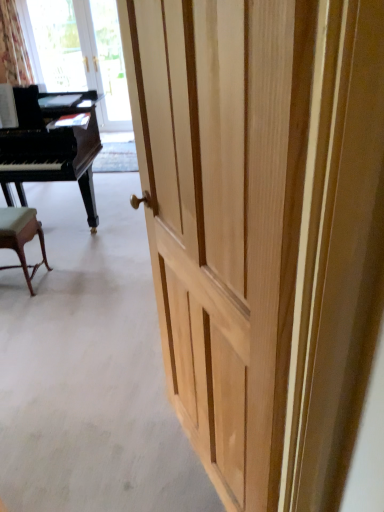
This screenshot has width=384, height=512. I want to click on transparent glass door at upper left, so click(x=110, y=67).

What do you see at coordinates (263, 230) in the screenshot? The width and height of the screenshot is (384, 512). I see `natural wood door at center` at bounding box center [263, 230].

What are the coordinates of `floral fabric curtain at upper left` in the screenshot? It's located at (13, 48).

Is natural wood door at center aimed at black polished piano at left?

No, natural wood door at center is not aimed at black polished piano at left.

Which is in front, natural wood door at center or black polished piano at left?

natural wood door at center is closer to the camera.

From the picture: Can you confirm if natural wood door at center is thinner than black polished piano at left?

Yes.

Can you confirm if natural wood door at center is taller than black polished piano at left?

Yes.

Does transparent glass window screen at upper left turn towards floral fabric curtain at upper left?

No.

Does point (65, 27) come closer to viewer compared to point (1, 42)?

No, (65, 27) is further to viewer.

This screenshot has width=384, height=512. I want to click on curtain below the transparent glass window screen at upper left (from the image's perspective), so click(x=13, y=48).

Is transparent glass window screen at upper left not close to floral fabric curtain at upper left?

Actually, transparent glass window screen at upper left and floral fabric curtain at upper left are a little close together.

Which is more to the right, floral fabric curtain at upper left or transparent glass window screen at upper left?

From the viewer's perspective, transparent glass window screen at upper left appears more on the right side.

How far apart are floral fabric curtain at upper left and transparent glass window screen at upper left?

They are 22.12 inches apart.

Which of these two, floral fabric curtain at upper left or transparent glass window screen at upper left, stands shorter?

floral fabric curtain at upper left.

From the image's perspective, is floral fabric curtain at upper left above or below transparent glass window screen at upper left?

Clearly, from the image's perspective, floral fabric curtain at upper left is below transparent glass window screen at upper left.

Considering the relative sizes of transparent glass door at upper left and green fabric stool at lower left in the image provided, is transparent glass door at upper left taller than green fabric stool at lower left?

Correct, transparent glass door at upper left is much taller as green fabric stool at lower left.

Would you say transparent glass door at upper left is inside or outside green fabric stool at lower left?

transparent glass door at upper left is not enclosed by green fabric stool at lower left.

Can you see transparent glass door at upper left touching green fabric stool at lower left?

There is a gap between transparent glass door at upper left and green fabric stool at lower left.

Considering the sizes of objects transparent glass door at upper left and green fabric stool at lower left in the image provided, who is bigger, transparent glass door at upper left or green fabric stool at lower left?

transparent glass door at upper left.

Between point (20, 133) and point (38, 226), which one is positioned behind?

The point (20, 133) is more distant.

Is black polished piano at left behind green fabric stool at lower left?

Yes, black polished piano at left is further from the viewer.

Between black polished piano at left and green fabric stool at lower left, which one has smaller width?

With smaller width is green fabric stool at lower left.

Can you confirm if transparent glass door at upper left is bigger than black polished piano at left?

Incorrect, transparent glass door at upper left is not larger than black polished piano at left.

From the image's perspective, which is below, transparent glass door at upper left or black polished piano at left?

From the image's view, black polished piano at left is below.

Is transparent glass door at upper left not inside black polished piano at left?

Yes, transparent glass door at upper left is outside of black polished piano at left.

Considering the positions of point (220, 185) and point (112, 34), is point (220, 185) closer or farther from the camera than point (112, 34)?

Point (220, 185) is positioned closer to the camera compared to point (112, 34).

Image resolution: width=384 pixels, height=512 pixels. Find the location of `door below the transparent glass door at upper left (from the image's perspective)`. door below the transparent glass door at upper left (from the image's perspective) is located at coordinates (263, 230).

Which of these two, natural wood door at center or transparent glass door at upper left, is bigger?

transparent glass door at upper left.

Is natural wood door at center completely or partially outside of transparent glass door at upper left?

Yes.

What are the coordinates of `piano directly beneath the natural wood door at center (from a real-world perspective)` in the screenshot? It's located at (49, 149).

Identify the location of window screen above the floral fabric curtain at upper left (from the image's perspective). (57, 44).

Estimate the real-world distances between objects in this image. Which object is further from transparent glass window screen at upper left, natural wood door at center or transparent glass door at upper left?

The object further to transparent glass window screen at upper left is natural wood door at center.

Looking at the image, which one is located further to green fabric stool at lower left, transparent glass window screen at upper left or black polished piano at left?

Based on the image, transparent glass window screen at upper left appears to be further to green fabric stool at lower left.

Estimate the real-world distances between objects in this image. Which object is closer to floral fabric curtain at upper left, transparent glass door at upper left or natural wood door at center?

transparent glass door at upper left lies closer to floral fabric curtain at upper left than the other object.

Looking at the image, which one is located further to transparent glass window screen at upper left, natural wood door at center or green fabric stool at lower left?

The object further to transparent glass window screen at upper left is natural wood door at center.

Considering their positions, is green fabric stool at lower left positioned closer to floral fabric curtain at upper left than transparent glass door at upper left?

Among the two, transparent glass door at upper left is located nearer to floral fabric curtain at upper left.

Considering their positions, is transparent glass door at upper left positioned closer to green fabric stool at lower left than natural wood door at center?

The object closer to green fabric stool at lower left is natural wood door at center.

Looking at the image, which one is located further to green fabric stool at lower left, floral fabric curtain at upper left or transparent glass door at upper left?

transparent glass door at upper left.

Considering their positions, is transparent glass door at upper left positioned further to floral fabric curtain at upper left than green fabric stool at lower left?

green fabric stool at lower left is positioned further to the anchor floral fabric curtain at upper left.

Locate an element on the screen. This screenshot has width=384, height=512. curtain between natural wood door at center and transparent glass window screen at upper left in the front-back direction is located at coordinates tap(13, 48).

I want to click on curtain between transparent glass window screen at upper left and green fabric stool at lower left vertically, so click(x=13, y=48).

The image size is (384, 512). Find the location of `piano between floral fabric curtain at upper left and green fabric stool at lower left vertically`. piano between floral fabric curtain at upper left and green fabric stool at lower left vertically is located at coordinates (49, 149).

The image size is (384, 512). I want to click on glass door positioned between natural wood door at center and transparent glass window screen at upper left from near to far, so click(110, 67).